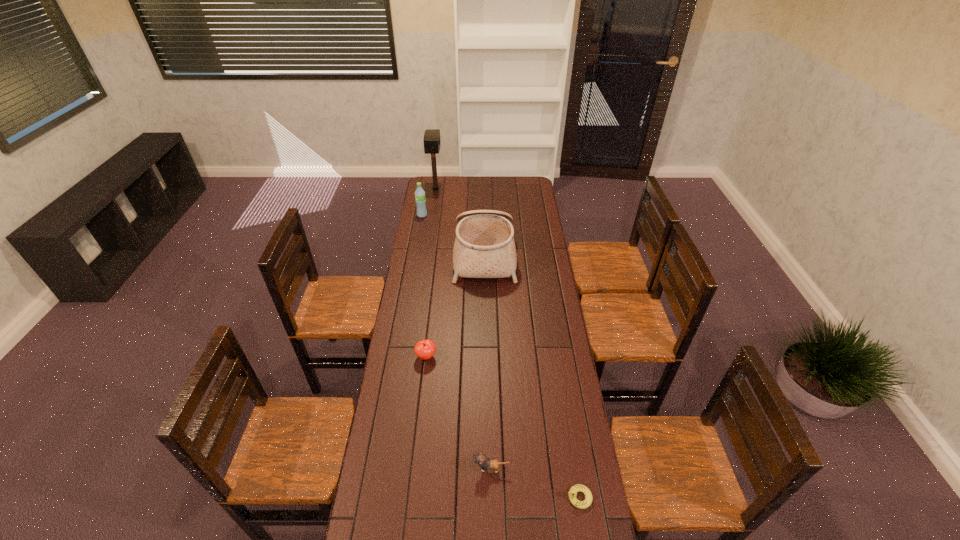
Where is `free region located 0.260m on the face of the rightmost object`? free region located 0.260m on the face of the rightmost object is located at coordinates (486, 497).

Where is `object located in the far edge section of the desktop`? The width and height of the screenshot is (960, 540). object located in the far edge section of the desktop is located at coordinates (432, 142).

Locate an element on the screen. mallet that is at the left edge is located at coordinates (432, 142).

This screenshot has width=960, height=540. I want to click on water bottle that is at the left edge, so click(420, 199).

Where is `apple located at the left edge`? Image resolution: width=960 pixels, height=540 pixels. apple located at the left edge is located at coordinates (425, 349).

You are a GUI agent. You are given a task and a screenshot of the screen. Output one action in this format:
    pyautogui.click(x=<x>, y=<y>)
    Task: Click on the object located in the right edge section of the desktop
    The image size is (960, 540).
    Given the screenshot: What is the action you would take?
    pyautogui.click(x=574, y=489)

Find the location of a particular element. object at the far left corner is located at coordinates pos(432,142).

Where is `free region at the far edge of the desktop`? free region at the far edge of the desktop is located at coordinates (497, 195).

Where is `vacant space at the left edge`? vacant space at the left edge is located at coordinates (423, 235).

The height and width of the screenshot is (540, 960). I want to click on vacant space at the right edge of the desktop, so click(x=539, y=394).